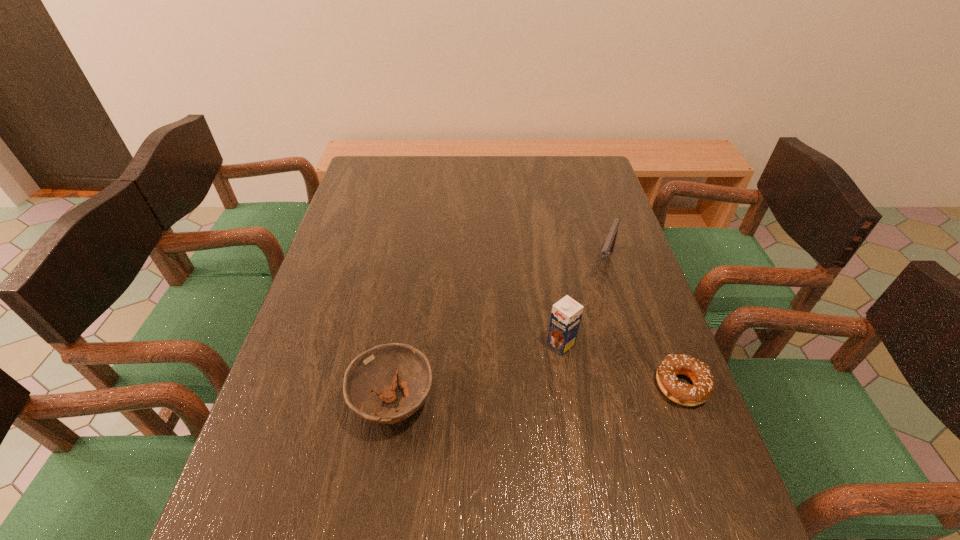
The image size is (960, 540). Identify the location of free space between the shortest object and the pistol. (643, 324).

This screenshot has height=540, width=960. I want to click on free space between the chocolate milk and the pistol, so click(583, 303).

This screenshot has height=540, width=960. In order to click on the second closest object relative to the doughnut in this screenshot , I will do `click(608, 247)`.

Find the location of `object that is the third nearest to the doughnut`. object that is the third nearest to the doughnut is located at coordinates (372, 377).

At what (x,y) coordinates should I click in order to perform the action: click on vacant space that satisfies the following two spatial constraints: 1. on the back side of the third tallest object; 2. on the right side of the third shortest object. Please return your answer as a coordinate pair (x, y). The image size is (960, 540). Looking at the image, I should click on (416, 262).

You are a GUI agent. You are given a task and a screenshot of the screen. Output one action in this format:
    pyautogui.click(x=<x>, y=<y>)
    Task: Click on the free region that satisfies the following two spatial constraints: 1. on the front side of the tallest object; 2. on the right side of the doughnut
    
    Given the screenshot: What is the action you would take?
    567,386

This screenshot has height=540, width=960. In order to click on vacant space that satisfies the following two spatial constraints: 1. on the back side of the farthest object; 2. on the left side of the third nearest object in this screenshot , I will do `click(547, 262)`.

Identify the location of free region that satisfies the following two spatial constraints: 1. on the front side of the pistol; 2. on the left side of the shortest object. The width and height of the screenshot is (960, 540). (642, 386).